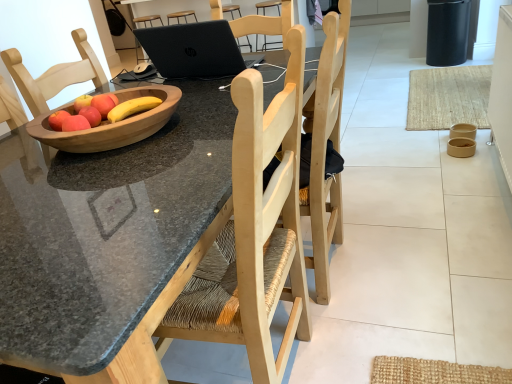
The height and width of the screenshot is (384, 512). I want to click on vacant space to the left of black matte trash bin/can at upper right, so click(412, 66).